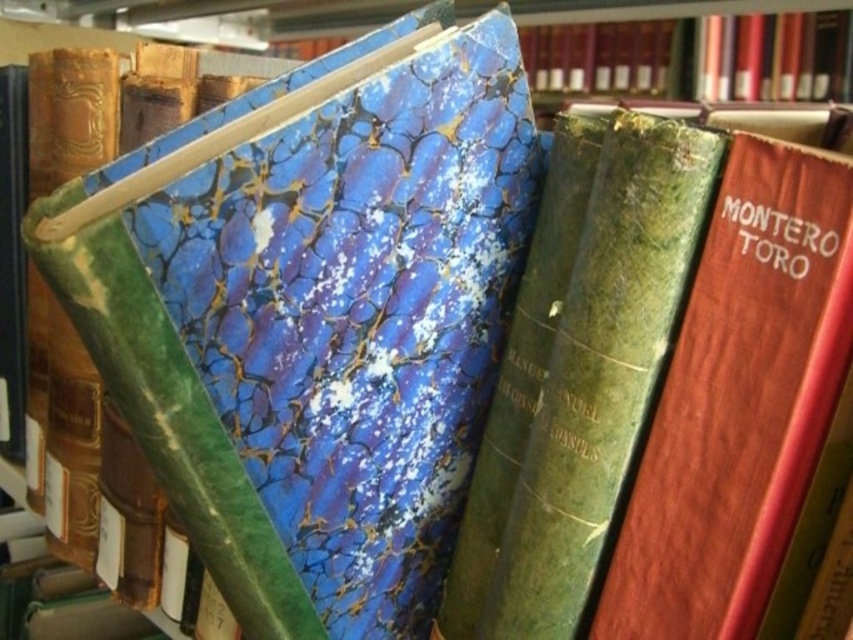
Question: Is wooden book at center closer to the viewer compared to green marbled book at center?

Choices:
 (A) yes
 (B) no

Answer: (A)

Question: Among these points, which one is nearest to the camera?

Choices:
 (A) (608, 170)
 (B) (636, 634)

Answer: (A)

Question: Does wooden book at center appear on the left side of green marbled book at center?

Choices:
 (A) no
 (B) yes

Answer: (A)

Question: Which of the following is the closest to the observer?

Choices:
 (A) green marbled book at center
 (B) wooden book at center

Answer: (B)

Question: Is wooden book at center smaller than green marbled book at center?

Choices:
 (A) yes
 (B) no

Answer: (A)